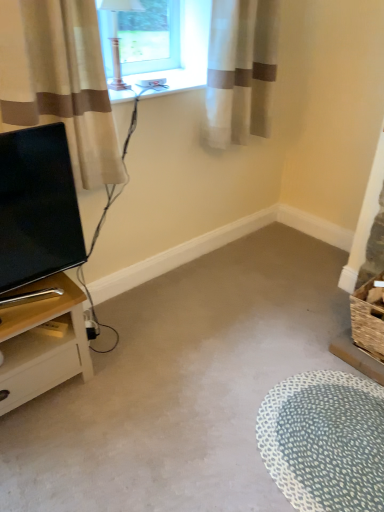
At what (x,y) coordinates should I click in order to perform the action: click on free space above white dotted rug at lower right (from a real-world perspective). Please return your answer as a coordinate pair (x, y). Looking at the image, I should click on (323, 433).